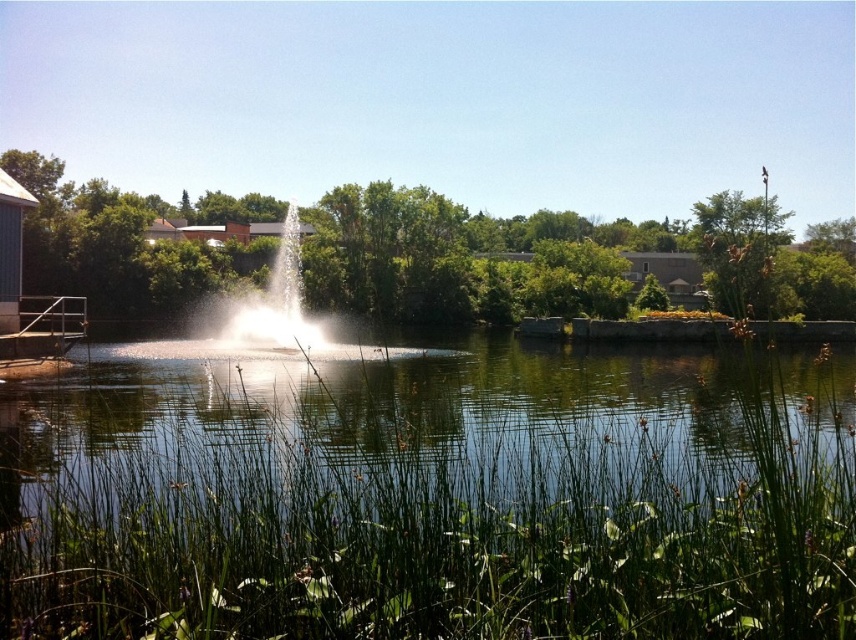
Is point (138, 381) in front of point (229, 339)?

Yes.

Is point (262, 397) more distant than point (277, 316)?

That is False.

What do you see at coordinates (397, 422) in the screenshot?
I see `clear water at center` at bounding box center [397, 422].

At what (x,y) coordinates should I click in order to perform the action: click on clear water at center. Please return your answer as a coordinate pair (x, y). The image size is (856, 640). Looking at the image, I should click on (397, 422).